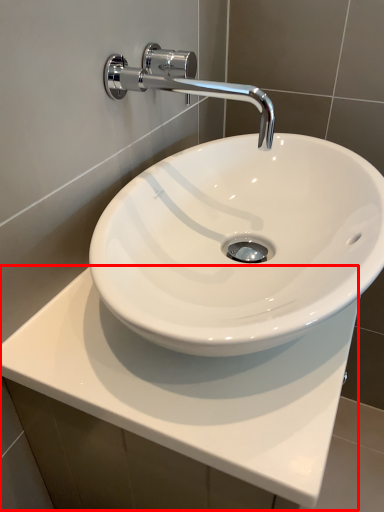
Question: From the image's perspective, considering the relative positions of counter top (annotated by the red box) and tap in the image provided, where is counter top (annotated by the red box) located with respect to the staircase?

Choices:
 (A) above
 (B) below

Answer: (B)